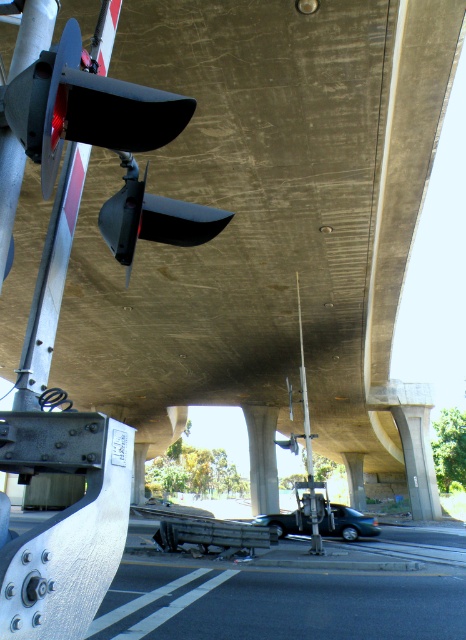
You are a pedestrian standing under the overpass and want to walk towards the traffic signal pole. Which object, the brushed metal highway at lower center or the matte black traffic light at center, will you encounter first?

You will encounter the brushed metal highway at lower center first because it is closer to you than the matte black traffic light at center, which is further away.

You are a city planner assessing the visibility of traffic lights under an overpass. Given the scene described, would the matte black traffic light at center be more noticeable than the concrete at center from a distance?

The matte black traffic light at center is larger in size than the concrete at center, making it more noticeable from a distance.

You are a drone operator trying to map coordinates for a delivery route. You need to locate the matte black traffic light at center. What are its coordinates?

The coordinates of the matte black traffic light at center are at point (152, 218).